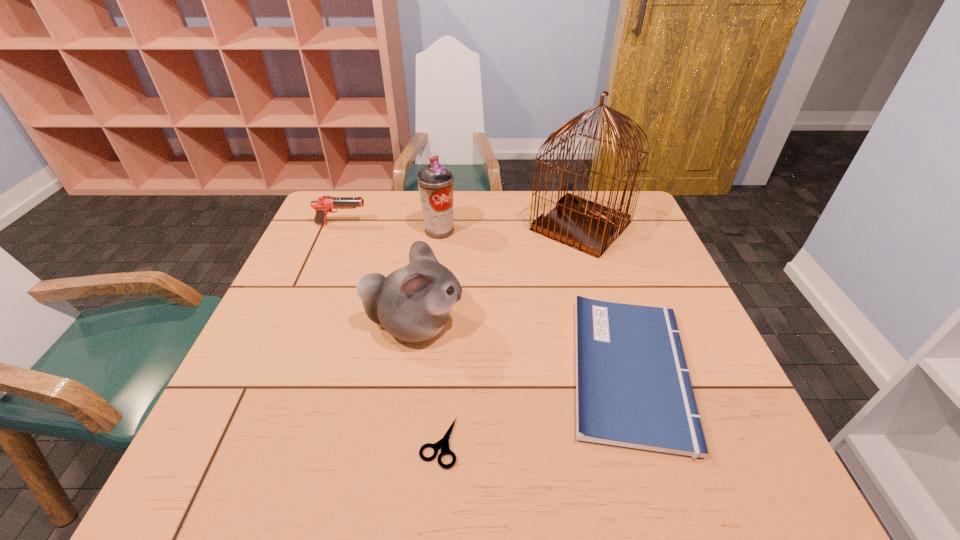
Find the location of a particular element. The width and height of the screenshot is (960, 540). the tallest object is located at coordinates (590, 227).

Where is `aerosol can`? The image size is (960, 540). aerosol can is located at coordinates (435, 182).

Where is `the third tallest object`? This screenshot has height=540, width=960. the third tallest object is located at coordinates (413, 303).

Where is `the fourth tallest object`? This screenshot has width=960, height=540. the fourth tallest object is located at coordinates (324, 205).

I want to click on the leftmost object, so click(324, 205).

You are a GUI agent. You are given a task and a screenshot of the screen. Output one action in this format:
    pyautogui.click(x=<x>, y=<y>)
    Task: Click on the paperback book
    The height and width of the screenshot is (540, 960).
    Given the screenshot: What is the action you would take?
    pyautogui.click(x=633, y=389)

You are a GUI agent. You are given a task and a screenshot of the screen. Output one action in this format:
    pyautogui.click(x=<x>, y=<y>)
    Task: Click on the shortest object
    
    Given the screenshot: What is the action you would take?
    pyautogui.click(x=443, y=444)

Where is `free space located 0.360m on the front of the tallest object`? This screenshot has width=960, height=540. free space located 0.360m on the front of the tallest object is located at coordinates (622, 362).

Image resolution: width=960 pixels, height=540 pixels. I want to click on free spot located 0.240m on the left of the second tallest object, so click(x=343, y=231).

You are a GUI agent. You are given a task and a screenshot of the screen. Output one action in this format:
    pyautogui.click(x=<x>, y=<y>)
    Task: Click on the vacant space located 0.370m on the face of the third tallest object
    
    Given the screenshot: What is the action you would take?
    pyautogui.click(x=621, y=326)